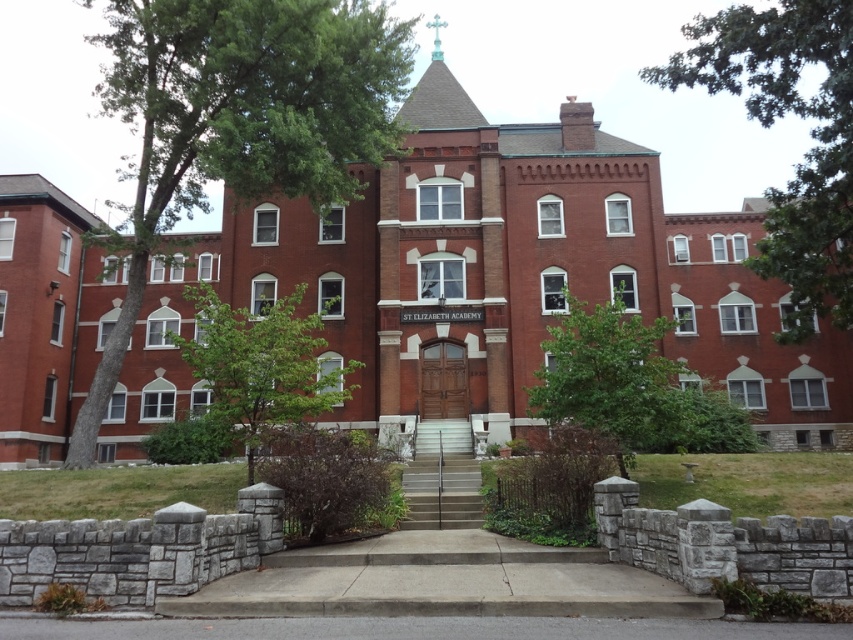
You are a photographer planning to take a photo of the brick church at center and the green leafy tree at lower left from a distance. Which object will appear bigger in the photo?

The brick church at center will appear bigger in the photo because it is larger in size than the green leafy tree at lower left.

You are standing in front of the brick church at center and the green leafy tree at lower left. Which one is positioned more to the left side of the scene?

The brick church at center is positioned more to the left side of the scene than the green leafy tree at lower left.